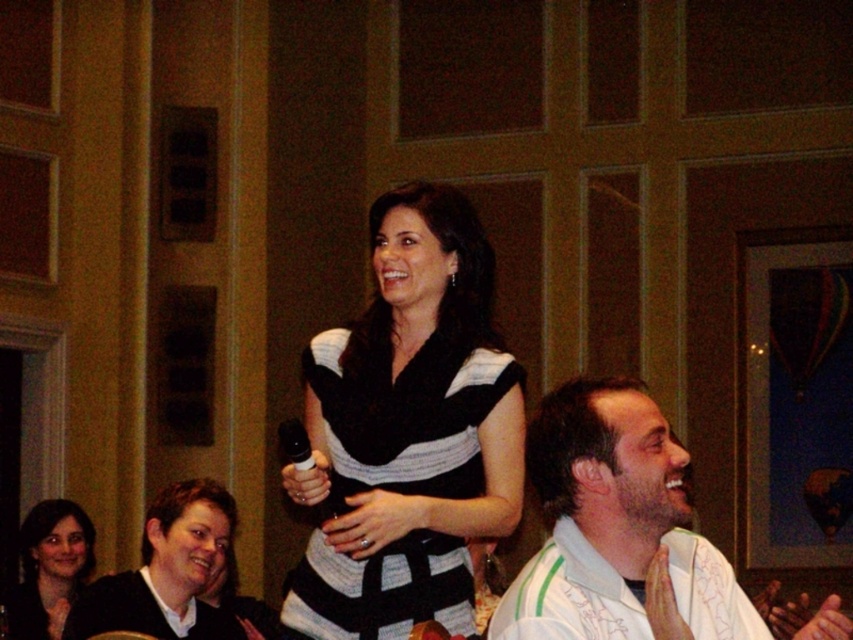
Which is more to the right, black and white striped dress at center or matte black sweater at lower left?

black and white striped dress at center is more to the right.

Is black and white striped dress at center thinner than matte black sweater at lower left?

Incorrect, black and white striped dress at center's width is not less than matte black sweater at lower left's.

Is point (343, 420) in front of point (187, 538)?

Yes, it is in front of point (187, 538).

Locate an element on the screen. The height and width of the screenshot is (640, 853). black and white striped dress at center is located at coordinates (407, 419).

Who is more distant from viewer, (564, 545) or (99, 612)?

The point (99, 612) is behind.

Does white textured shirt at lower right have a smaller size compared to matte black sweater at lower left?

Yes.

The height and width of the screenshot is (640, 853). I want to click on white textured shirt at lower right, so click(614, 529).

Who is positioned more to the left, black and white striped dress at center or smooth skin face at lower left?

Positioned to the left is smooth skin face at lower left.

Does point (442, 390) lie in front of point (35, 541)?

Yes, it is.

This screenshot has height=640, width=853. Describe the element at coordinates (407, 419) in the screenshot. I see `black and white striped dress at center` at that location.

This screenshot has width=853, height=640. I want to click on black and white striped dress at center, so click(407, 419).